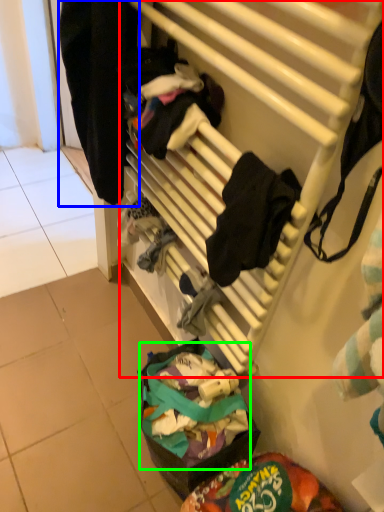
Question: Considering the real-world distances, which object is closest to furniture (highlighted by a red box)? clothing (highlighted by a blue box) or food (highlighted by a green box).

Choices:
 (A) clothing
 (B) food

Answer: (A)